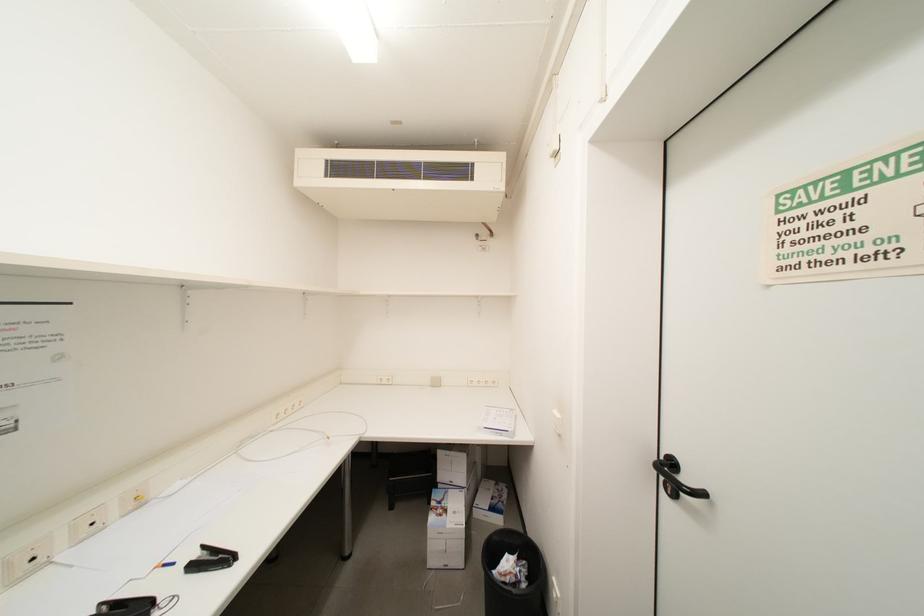
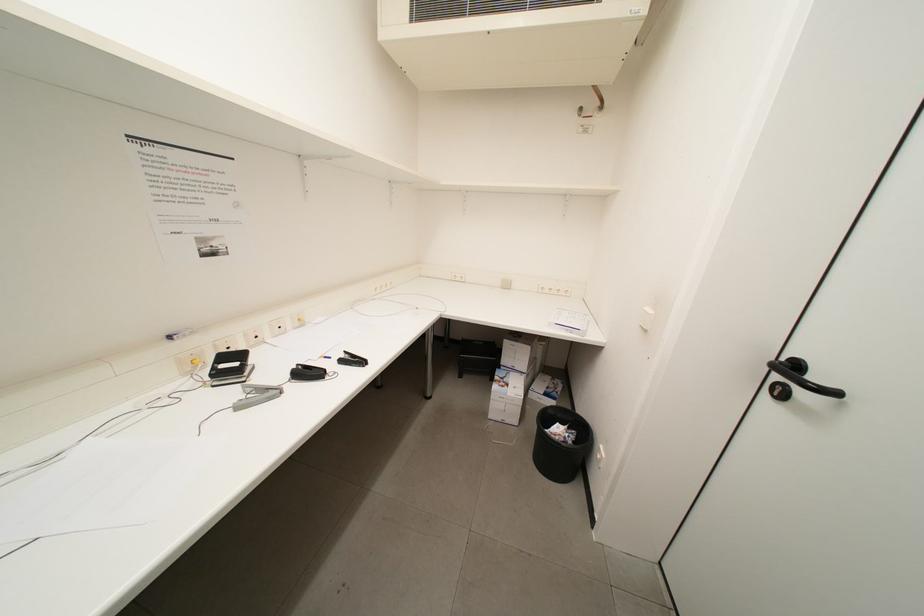
Question: Based on the continuous images, in which direction is the camera rotating? Reply with the corresponding letter.

Choices:
 (A) Left
 (B) Right
 (C) Up
 (D) Down

Answer: (D)